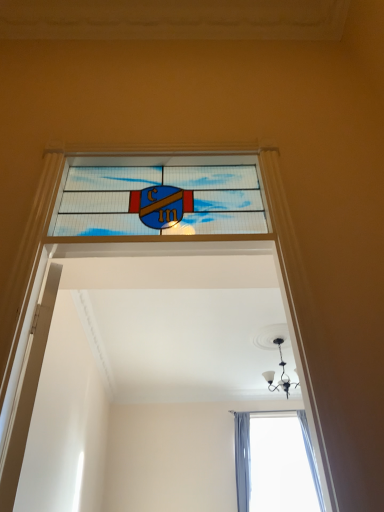
Question: Is black glass chandelier at upper center shorter than white glossy door at left?

Choices:
 (A) yes
 (B) no

Answer: (A)

Question: Does black glass chandelier at upper center have a smaller size compared to white glossy door at left?

Choices:
 (A) no
 (B) yes

Answer: (A)

Question: From the image's perspective, is black glass chandelier at upper center below white glossy door at left?

Choices:
 (A) yes
 (B) no

Answer: (A)

Question: Does black glass chandelier at upper center have a greater height compared to white glossy door at left?

Choices:
 (A) yes
 (B) no

Answer: (B)

Question: Does black glass chandelier at upper center appear on the left side of white glossy door at left?

Choices:
 (A) yes
 (B) no

Answer: (B)

Question: Are black glass chandelier at upper center and white glossy door at left located far from each other?

Choices:
 (A) yes
 (B) no

Answer: (A)

Question: Does black glass chandelier at upper center turn towards stained glass window at center?

Choices:
 (A) yes
 (B) no

Answer: (A)

Question: From a real-world perspective, is black glass chandelier at upper center beneath stained glass window at center?

Choices:
 (A) no
 (B) yes

Answer: (A)

Question: Does black glass chandelier at upper center have a greater height compared to stained glass window at center?

Choices:
 (A) no
 (B) yes

Answer: (B)

Question: Is black glass chandelier at upper center touching stained glass window at center?

Choices:
 (A) no
 (B) yes

Answer: (A)

Question: Is black glass chandelier at upper center at the right side of stained glass window at center?

Choices:
 (A) no
 (B) yes

Answer: (B)

Question: Is black glass chandelier at upper center wider than stained glass window at center?

Choices:
 (A) yes
 (B) no

Answer: (A)

Question: From a real-world perspective, is white glossy door at left positioned over stained glass window at center based on gravity?

Choices:
 (A) yes
 (B) no

Answer: (B)